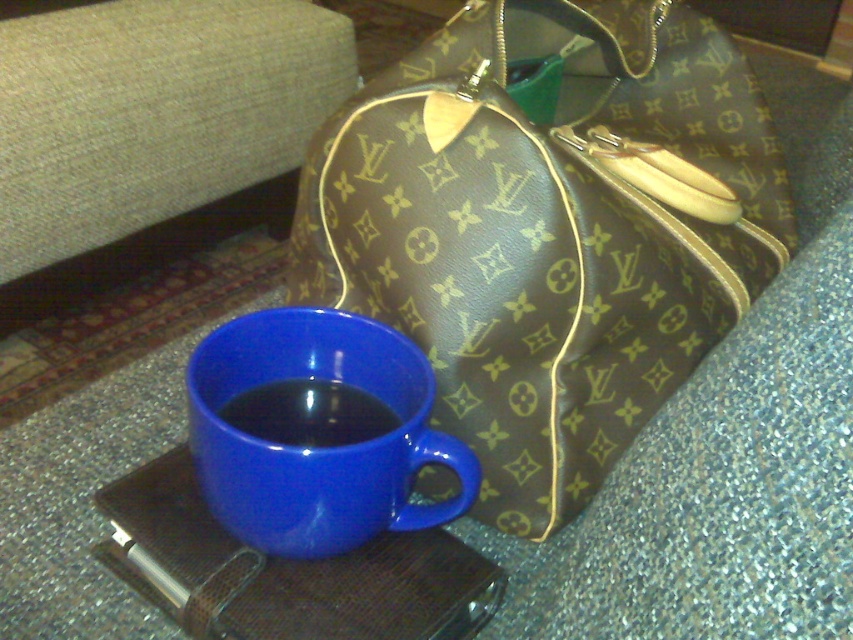
You are a delivery person trying to place a package on the surface between the brown monogrammed bag at center and the beige fabric couch at upper left. Can you fit the package there?

The brown monogrammed bag at center is in front of the beige fabric couch at upper left, so there is space between them where the package can be placed.

You are arranging items on a table and need to place a new item between the brown monogrammed bag at center and the glossy ceramic mug at lower left. Based on their positions, where should you place the new item?

The brown monogrammed bag at center is above the glossy ceramic mug at lower left, so the new item should be placed between them in the vertical space between the bag and the mug.